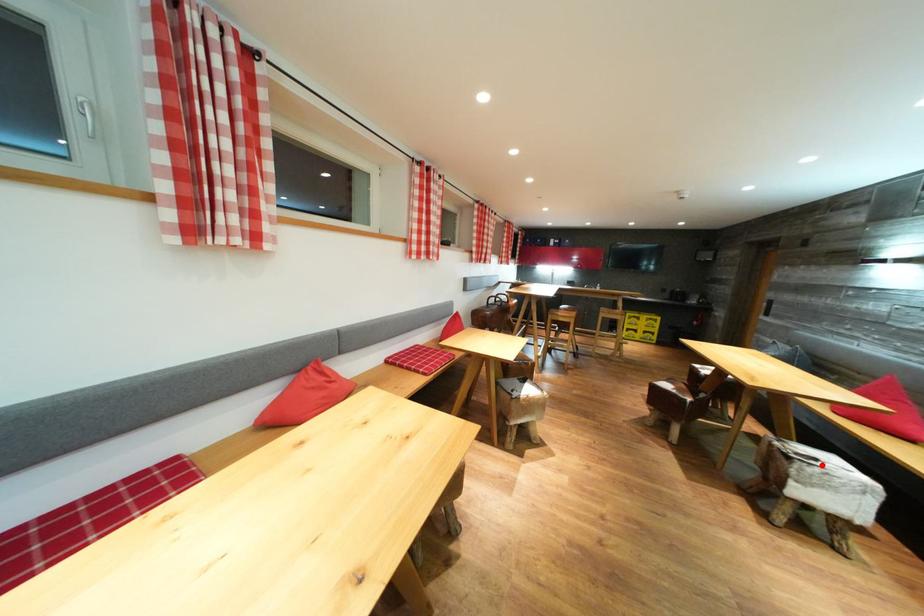
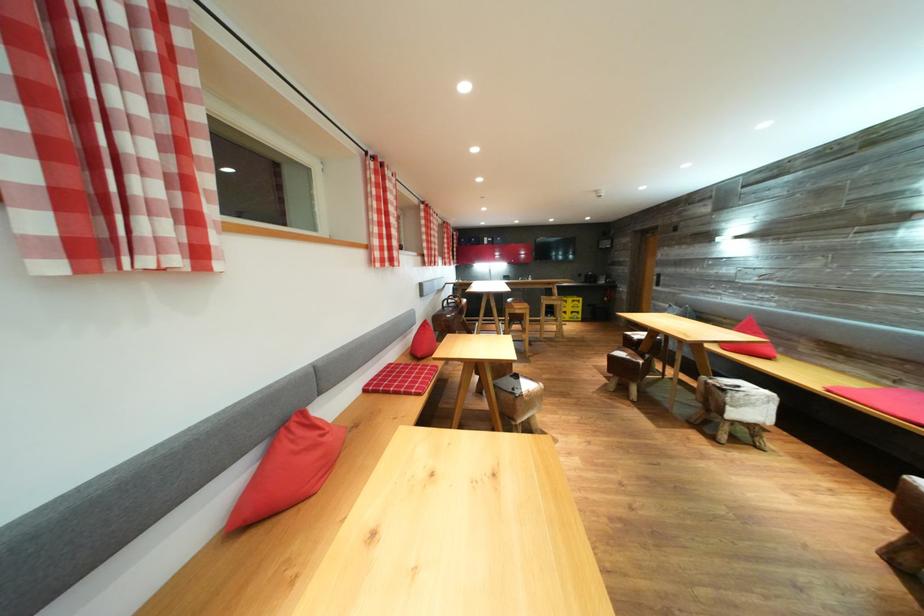
The point at the highlighted location is marked in the first image. Where is the corresponding point in the second image?

(745, 392)